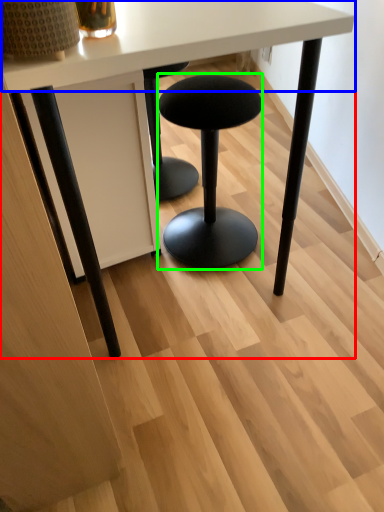
Question: Considering the real-world distances, which object is closest to table (highlighted by a red box)? round table (highlighted by a blue box) or stool (highlighted by a green box).

Choices:
 (A) round table
 (B) stool

Answer: (A)